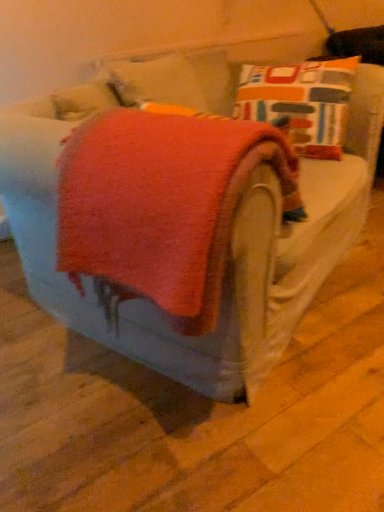
Question: Considering the positions of orange fabric at center and orange soft towel at center in the image, is orange fabric at center taller or shorter than orange soft towel at center?

Choices:
 (A) short
 (B) tall

Answer: (A)

Question: From a real-world perspective, is orange fabric at center positioned above or below orange soft towel at center?

Choices:
 (A) above
 (B) below

Answer: (B)

Question: Is orange fabric at center wider or thinner than orange soft towel at center?

Choices:
 (A) wide
 (B) thin

Answer: (A)

Question: Is orange soft towel at center spatially inside orange fabric at center, or outside of it?

Choices:
 (A) outside
 (B) inside

Answer: (A)

Question: In the image, is orange soft towel at center positioned in front of or behind orange fabric at center?

Choices:
 (A) behind
 (B) front

Answer: (A)

Question: Does point (162, 117) appear closer or farther from the camera than point (153, 336)?

Choices:
 (A) closer
 (B) farther

Answer: (A)

Question: Considering the positions of orange soft towel at center and orange fabric at center in the image, is orange soft towel at center wider or thinner than orange fabric at center?

Choices:
 (A) wide
 (B) thin

Answer: (B)